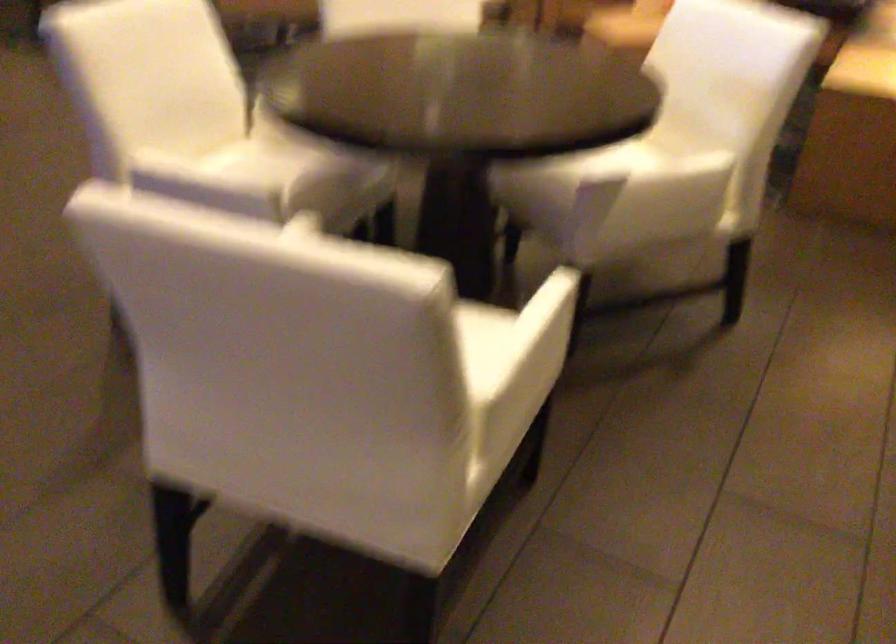
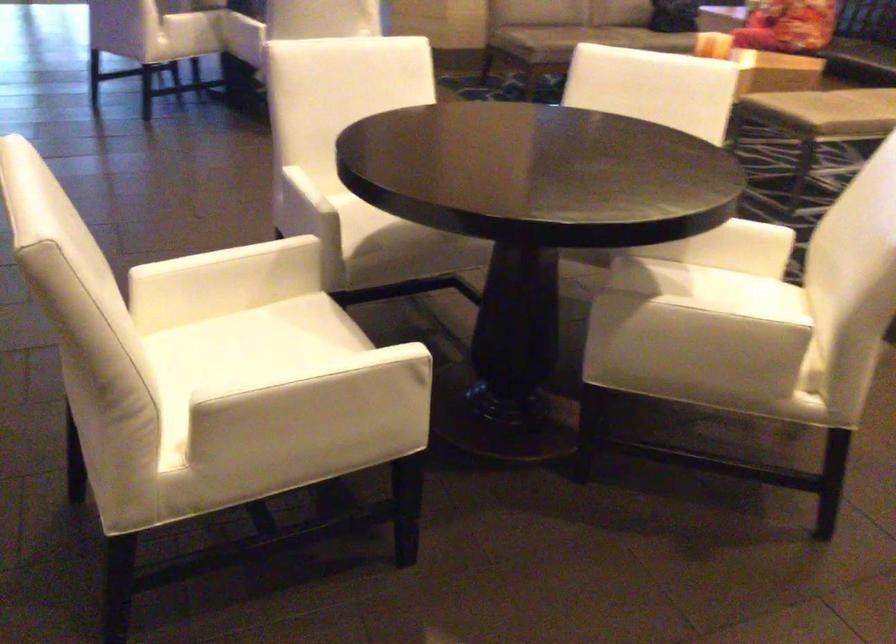
In the second image, find the point that corresponds to (660,176) in the first image.

(699, 319)